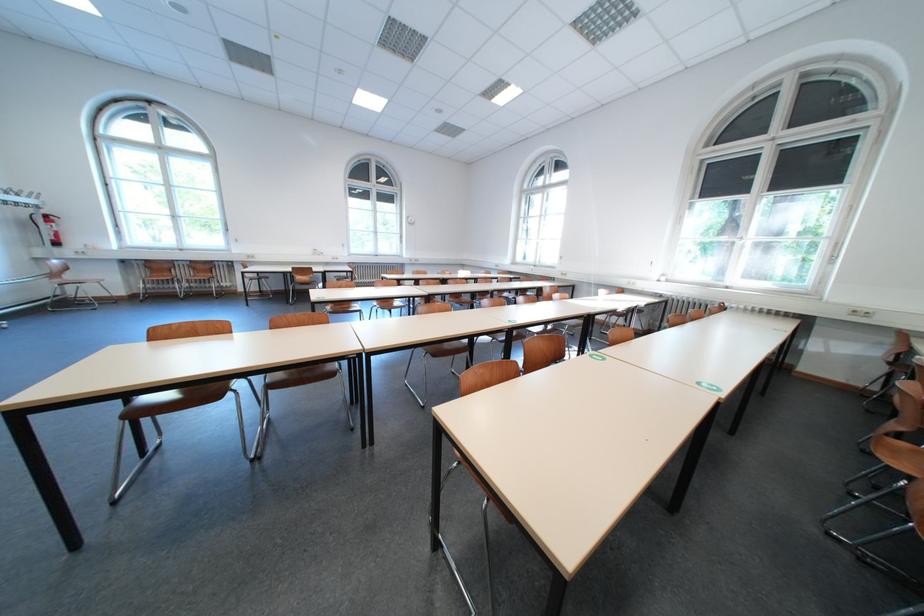
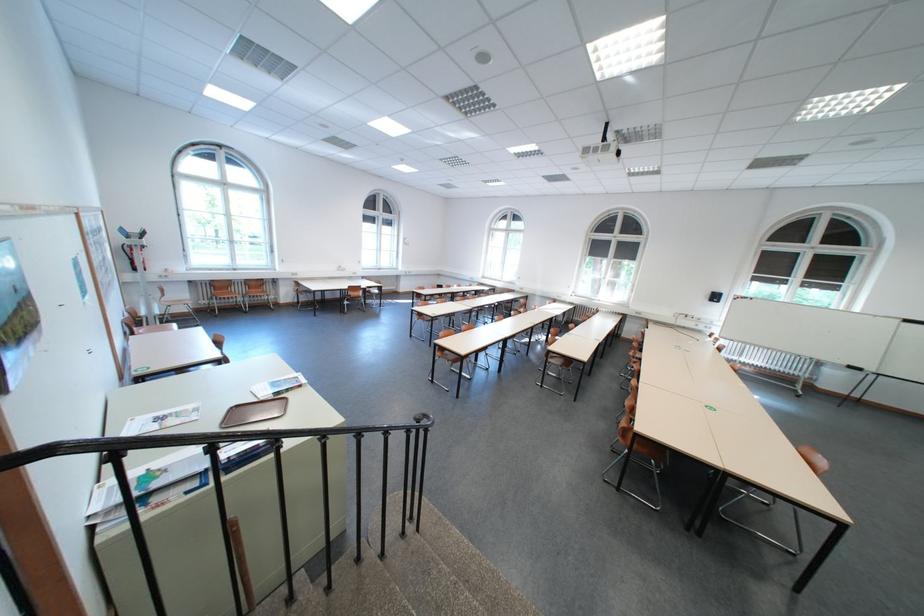
The point at (198, 274) is marked in the first image. Where is the corresponding point in the second image?

(252, 291)